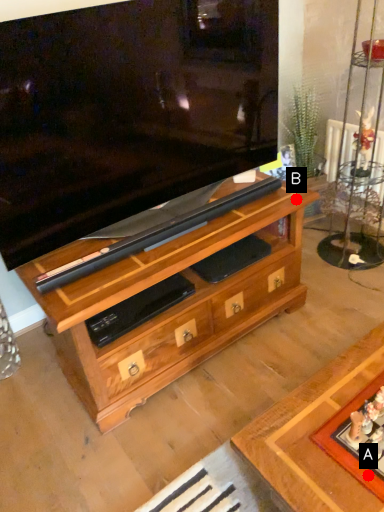
Question: Two points are circled on the image, labeled by A and B beside each circle. Which of the following is the farthest from the observer?

Choices:
 (A) A is further
 (B) B is further

Answer: (B)